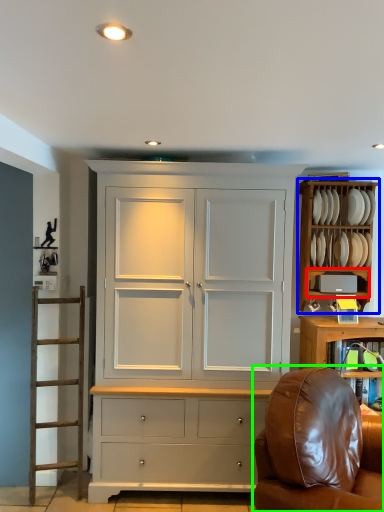
Question: Based on their relative distances, which object is nearer to shelf (highlighted by a red box)? Choose from cabinetry (highlighted by a blue box) and chair (highlighted by a green box).

Choices:
 (A) cabinetry
 (B) chair

Answer: (A)